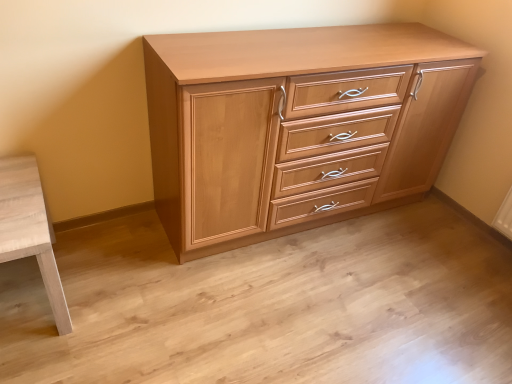
Identify the location of vacant space in front of light wood chest of drawers at center. This screenshot has height=384, width=512. (300, 307).